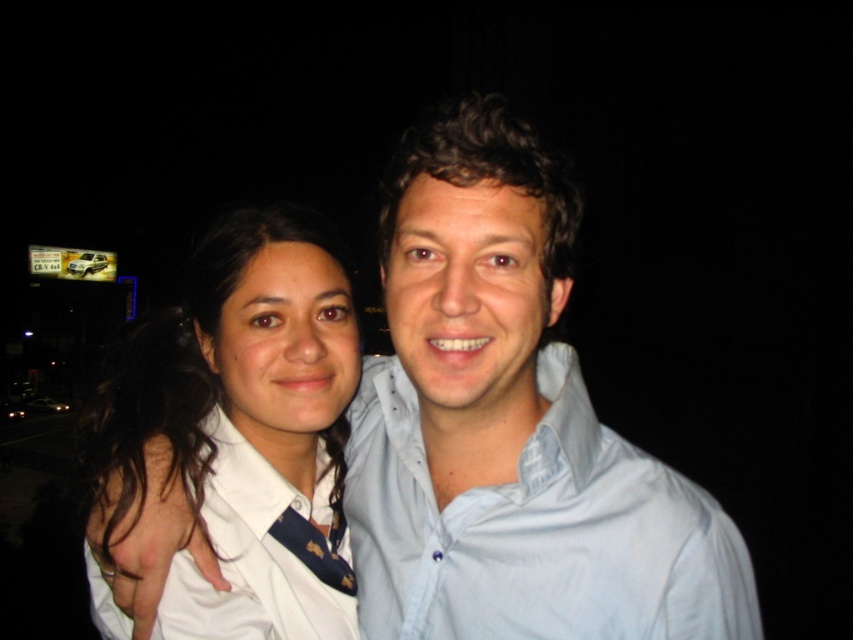
Is point (352, 483) positioned before point (337, 541)?

Yes, it is in front of point (337, 541).

Who is shorter, light blue cotton shirt at center or blue silk tie at center?

blue silk tie at center is shorter.

The width and height of the screenshot is (853, 640). Describe the element at coordinates (535, 531) in the screenshot. I see `light blue cotton shirt at center` at that location.

The image size is (853, 640). Identify the location of light blue cotton shirt at center. (535, 531).

Which is above, light blue cotton shirt at center or white shirt at center?

white shirt at center is above.

How far apart are light blue cotton shirt at center and white shirt at center?

light blue cotton shirt at center and white shirt at center are 9.11 inches apart from each other.

The image size is (853, 640). What do you see at coordinates (535, 531) in the screenshot? I see `light blue cotton shirt at center` at bounding box center [535, 531].

Image resolution: width=853 pixels, height=640 pixels. I want to click on light blue cotton shirt at center, so tap(535, 531).

Between point (199, 252) and point (280, 532), which one is positioned in front?

Point (280, 532) is in front.

Where is `white shirt at center`? The image size is (853, 640). white shirt at center is located at coordinates (248, 397).